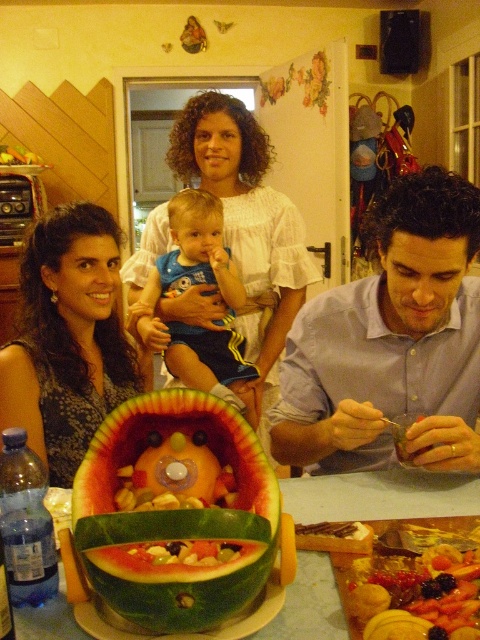
Is matte blue shirt at center positioned before watermelon with fruit inside at center?

No.

Which of these two, matte blue shirt at center or watermelon with fruit inside at center, stands shorter?

watermelon with fruit inside at center

Which is behind, point (407, 442) or point (156, 570)?

Point (407, 442)

The width and height of the screenshot is (480, 640). Identify the location of matte blue shirt at center. (392, 340).

Which of these two, matte blue shirt at center or smooth wooden table at center, stands taller?

Standing taller between the two is matte blue shirt at center.

Which is behind, point (348, 344) or point (62, 605)?

The point (348, 344) is behind.

At what (x,y) coordinates should I click in order to perform the action: click on matte blue shirt at center. Please return your answer as a coordinate pair (x, y). Looking at the image, I should click on (392, 340).

Between matte blue shirt at center and juicy red fruit at center, which one appears on the right side from the viewer's perspective?

Positioned to the right is matte blue shirt at center.

Locate an element on the screen. This screenshot has width=480, height=640. matte blue shirt at center is located at coordinates (392, 340).